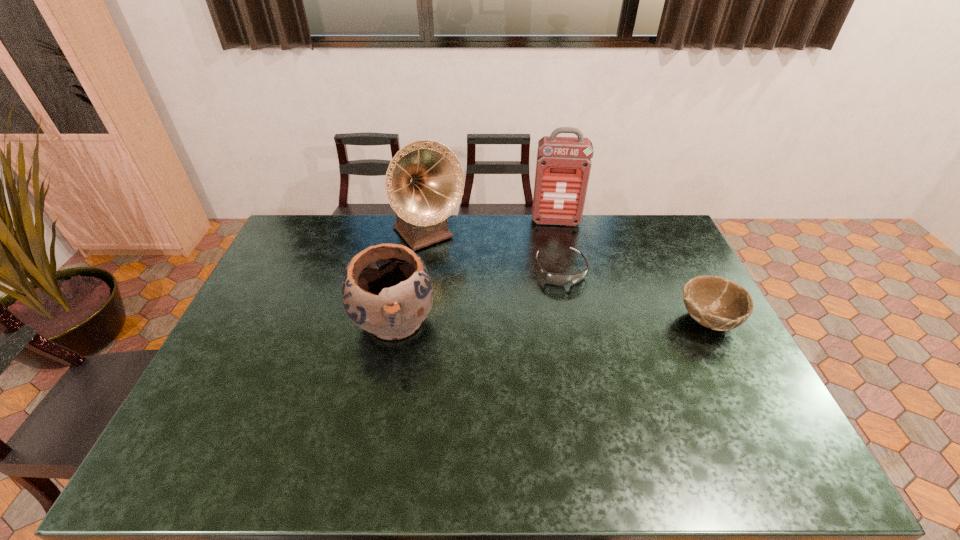
Identify the location of object that is positioned at the right edge. (715, 302).

In the image, there is a desktop. At what (x,y) coordinates should I click in order to perform the action: click on free space at the far edge. Please return your answer as a coordinate pair (x, y). This screenshot has height=540, width=960. Looking at the image, I should click on (451, 253).

The height and width of the screenshot is (540, 960). What are the coordinates of `vacant space at the near edge of the desktop` in the screenshot? It's located at (272, 427).

Where is `free location at the left edge of the desktop`? free location at the left edge of the desktop is located at coordinates (249, 367).

Where is `free space at the right edge of the desktop`? free space at the right edge of the desktop is located at coordinates (657, 296).

The height and width of the screenshot is (540, 960). In the image, there is a desktop. Find the location of `vacant space at the far right corner`. vacant space at the far right corner is located at coordinates (661, 242).

Locate an element on the screen. This screenshot has height=540, width=960. vacant space at the near right corner of the desktop is located at coordinates (711, 413).

This screenshot has height=540, width=960. Identify the location of vacant area between the phonograph record and the first-aid kit. (492, 228).

Identify the location of vacant space in between the bowl and the pottery. (551, 321).

The width and height of the screenshot is (960, 540). I want to click on blank region between the first-aid kit and the phonograph record, so click(x=492, y=228).